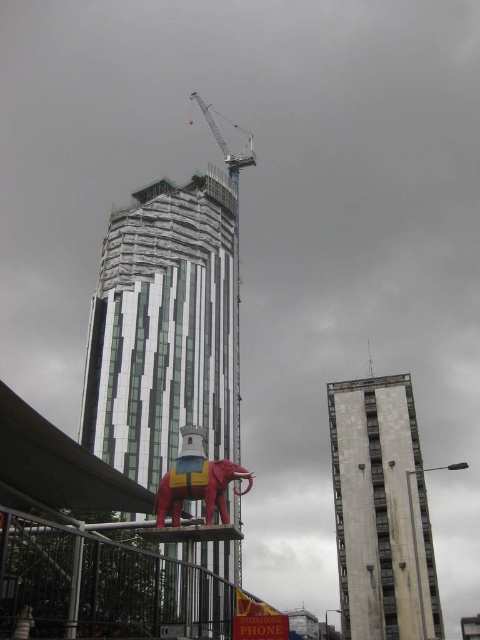
Question: Is the position of white marble building at center more distant than that of shiny red elephant at center?

Choices:
 (A) no
 (B) yes

Answer: (B)

Question: Which point is farther from the camera taking this photo?

Choices:
 (A) click(x=223, y=228)
 (B) click(x=205, y=506)

Answer: (A)

Question: Considering the real-world distances, which object is closest to the white marble building at center?

Choices:
 (A) shiny red elephant at center
 (B) white glass tower at center

Answer: (B)

Question: Which point is closer to the camera taking this photo?

Choices:
 (A) (425, 596)
 (B) (206, 515)

Answer: (B)

Question: Can you confirm if white glass tower at center is wider than shiny red elephant at center?

Choices:
 (A) yes
 (B) no

Answer: (A)

Question: Is white marble building at center in front of shiny red elephant at center?

Choices:
 (A) no
 (B) yes

Answer: (A)